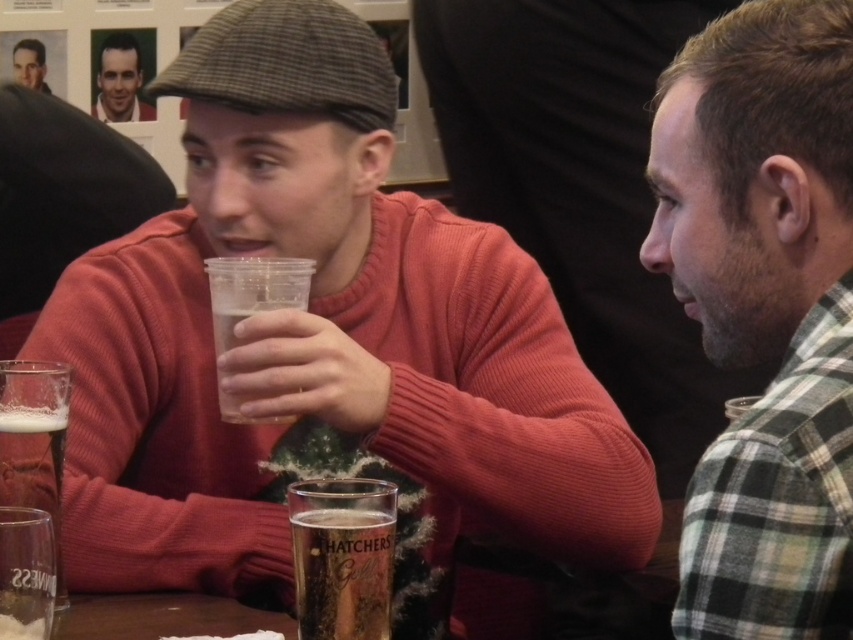
You are standing in front of the table at the bar. There are two points marked on the table. The first point is at coordinates point [6,634] and the second point is at coordinates point [38,77]. Which point is closer to you?

Point [6,634] is closer to the viewer than point [38,77].

You are a bartender who needs to place a new drink order. You have a limited shelf space. The clear glass at left and the matte black sweater at center are on the shelf. Which one takes up more space?

The clear glass at left is bigger than the matte black sweater at center, so it takes up more space.

Based on the scene description, where is the translucent plastic cup at center located in terms of coordinates?

The translucent plastic cup at center is located at coordinates point [252,291].